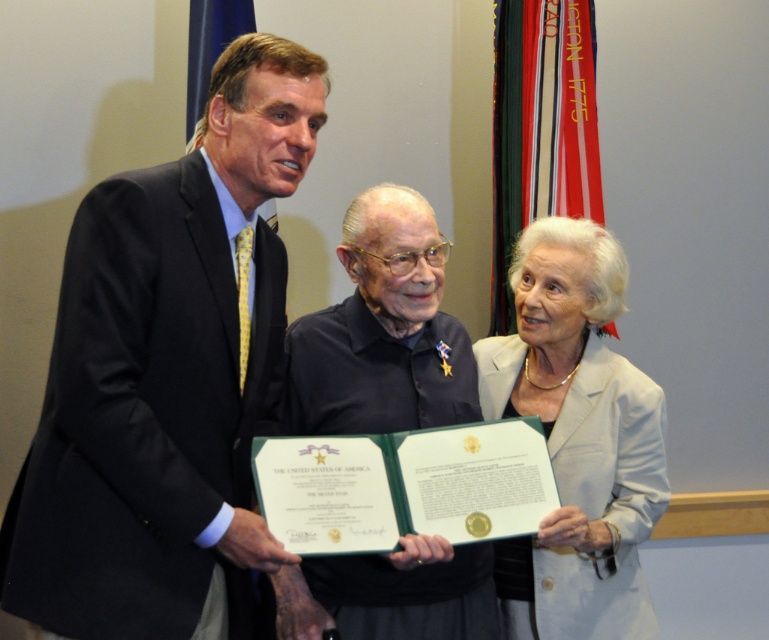
You are attending this formal event and want to take a photo of the dark suit at center and the black matte shirt at center. Which one will appear larger in your photo?

The dark suit at center will appear larger in the photo because it is closer to the viewer than the black matte shirt at center.

You are a photographer at this event and need to ensure that both the dark suit at center and the light beige fabric at center are fully visible in the photo. Given that the camera frame can only accommodate objects up to the width of the wider of the two, which object determines the minimum required frame width?

The dark suit at center determines the minimum required frame width because its width is larger than the light beige fabric at center.

You are organizing a photo shoot and need to ensure that the light beige fabric at center and the black matte shirt at center are visible in the frame. Based on their sizes, which object should you focus on to ensure both are in the frame?

The light beige fabric at center has a larger size compared to the black matte shirt at center, so focusing on the larger light beige fabric at center would help ensure both are visible in the frame.